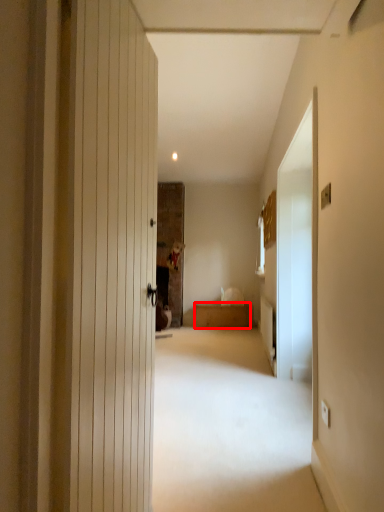
Question: From the image's perspective, what is the correct spatial positioning of furniture (annotated by the red box) in reference to screen door?

Choices:
 (A) below
 (B) above

Answer: (A)